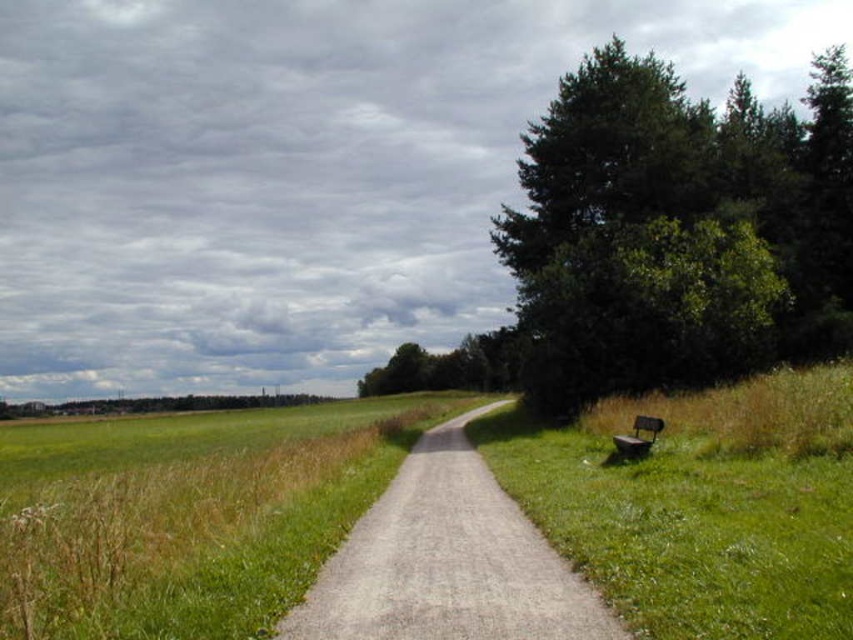
You are standing at the point closer to the camera between the two points, point (x=840, y=310) and point (x=659, y=428). Which point are you standing at?

You are standing at point (x=840, y=310) because it is further to the camera than point (x=659, y=428).

You are standing at the start of the gray gravel path at center and want to reach the wooden park bench at right. Which direction should you walk to get there?

The gray gravel path at center is in front of the wooden park bench at right, so you should walk forward along the gray gravel path at center to reach the wooden park bench at right.